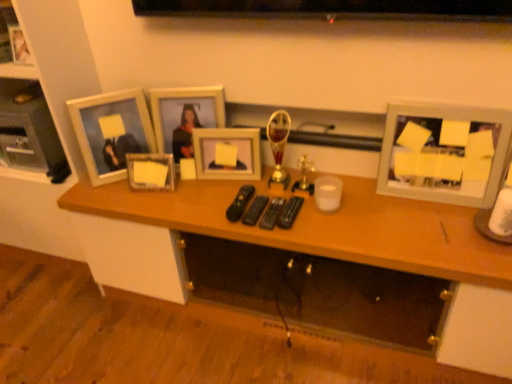
At what (x,y) coordinates should I click in order to perform the action: click on vacant space that is to the left of black plastic remote control at center, placed as the fourth remote control when sorted from left to right. Please return your answer as a coordinate pair (x, y). Image resolution: width=512 pixels, height=384 pixels. Looking at the image, I should click on (227, 208).